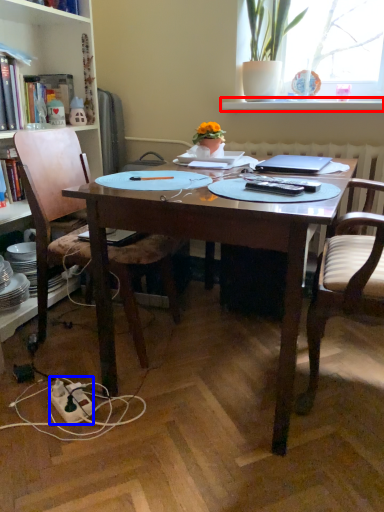
Question: Which object is further to the camera taking this photo, window sill (highlighted by a red box) or power outlet (highlighted by a blue box)?

Choices:
 (A) window sill
 (B) power outlet

Answer: (A)